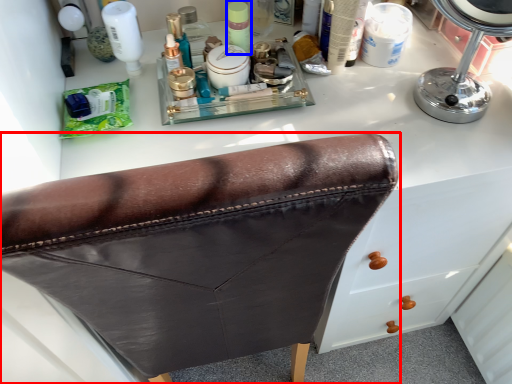
Question: Which object appears farthest to the camera in this image, furniture (highlighted by a red box) or toiletry (highlighted by a blue box)?

Choices:
 (A) furniture
 (B) toiletry

Answer: (B)